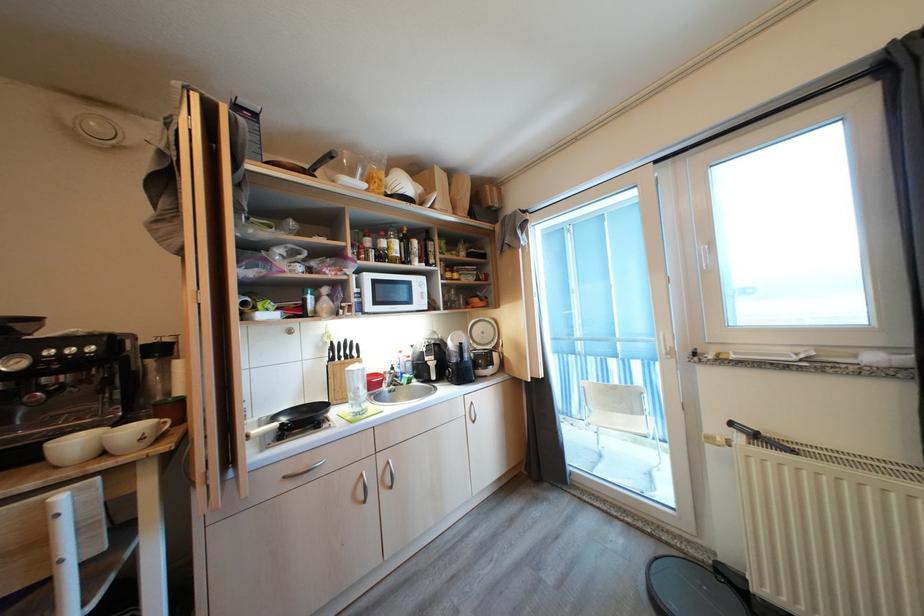
In order to click on white radiator valve in this screenshot , I will do `click(791, 448)`.